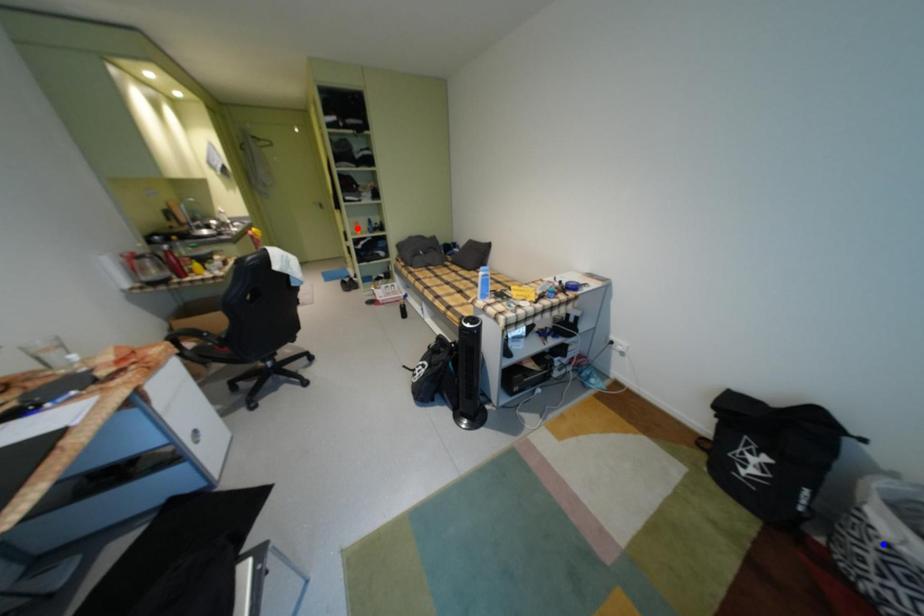
Question: In the image, two points are highlighted. Which point is nearer to the camera? Reply with the corresponding letter.

Choices:
 (A) blue point
 (B) red point

Answer: (A)